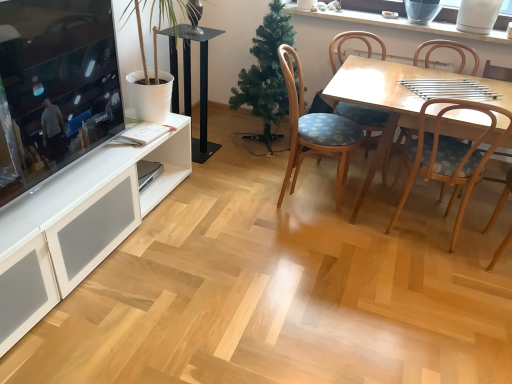
Image resolution: width=512 pixels, height=384 pixels. I want to click on free space in front of green matte christmas tree at center, so click(x=244, y=171).